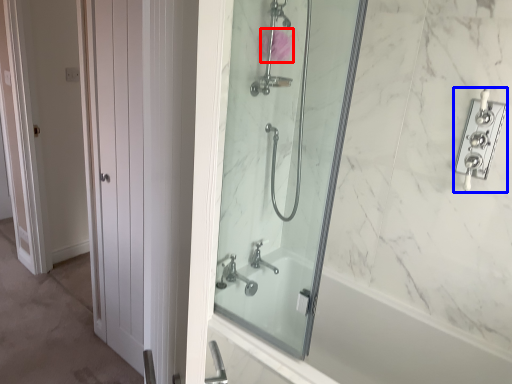
Question: Which object appears closest to the camera in this image, flower (highlighted by a red box) or lock (highlighted by a blue box)?

Choices:
 (A) flower
 (B) lock

Answer: (B)